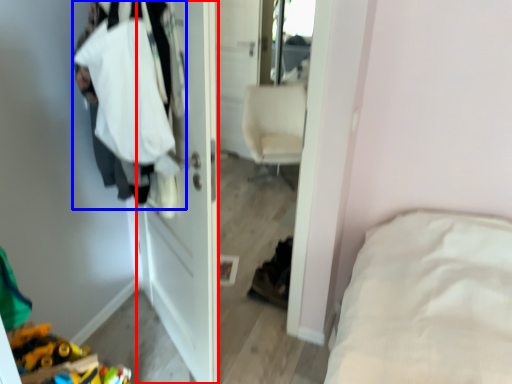
Question: Which object is closer to the camera taking this photo, door (highlighted by a red box) or clothing (highlighted by a blue box)?

Choices:
 (A) door
 (B) clothing

Answer: (B)